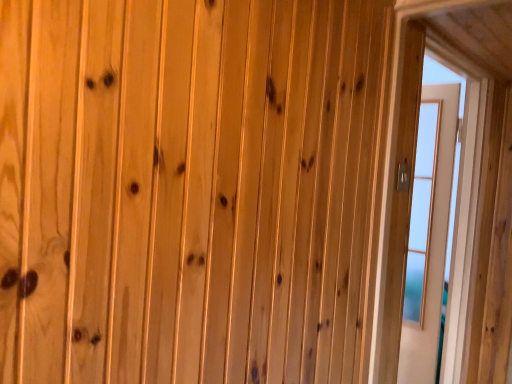
The image size is (512, 384). Describe the element at coordinates (429, 235) in the screenshot. I see `light brown wood door at right` at that location.

What is the approximate height of light brown wood door at right?

light brown wood door at right is 1.65 meters tall.

What is the approximate width of light brown wood door at right?

light brown wood door at right is 2.75 inches wide.

Where is `light brown wood door at right`? light brown wood door at right is located at coordinates (429, 235).

Measure the distance between light brown wood door at right and camera.

light brown wood door at right is 2.12 meters from camera.

The width and height of the screenshot is (512, 384). I want to click on transparent glass door at right, so click(x=395, y=193).

The width and height of the screenshot is (512, 384). What do you see at coordinates (395, 193) in the screenshot? I see `transparent glass door at right` at bounding box center [395, 193].

Find the location of a particular element. The height and width of the screenshot is (384, 512). light brown wood door at right is located at coordinates (429, 235).

Considering the relative positions of transparent glass door at right and light brown wood door at right in the image provided, is transparent glass door at right to the left or to the right of light brown wood door at right?

From the image, it's evident that transparent glass door at right is to the left of light brown wood door at right.

In the image, is transparent glass door at right positioned in front of or behind light brown wood door at right?

transparent glass door at right is in front of light brown wood door at right.

Does point (389, 288) come farther from viewer compared to point (439, 151)?

No, (389, 288) is closer to viewer.

From the picture: From the image's perspective, is transparent glass door at right over light brown wood door at right?

Yes, from the image's perspective, transparent glass door at right is above light brown wood door at right.

From a real-world perspective, between transparent glass door at right and light brown wood door at right, who is vertically lower?

light brown wood door at right.

Between transparent glass door at right and light brown wood door at right, which one has larger width?

With larger width is transparent glass door at right.

From the picture: Who is taller, transparent glass door at right or light brown wood door at right?

Standing taller between the two is light brown wood door at right.

Looking at this image, is transparent glass door at right bigger or smaller than light brown wood door at right?

Considering their sizes, transparent glass door at right takes up more space than light brown wood door at right.

Is transparent glass door at right not within light brown wood door at right?

Absolutely, transparent glass door at right is external to light brown wood door at right.

In the scene shown: Is transparent glass door at right directly adjacent to light brown wood door at right?

No, transparent glass door at right is not with light brown wood door at right.

Is transparent glass door at right looking in the opposite direction of light brown wood door at right?

Yes, transparent glass door at right is positioned with its back facing light brown wood door at right.

Identify the location of window to the left of light brown wood door at right. (395, 193).

Which is more to the right, light brown wood door at right or transparent glass door at right?

From the viewer's perspective, light brown wood door at right appears more on the right side.

Relative to transparent glass door at right, is light brown wood door at right in front or behind?

In the image, light brown wood door at right appears behind transparent glass door at right.

Which is behind, point (441, 250) or point (377, 313)?

Point (441, 250)

Consider the image. From the image's perspective, is light brown wood door at right located above or below transparent glass door at right?

From the image's perspective, light brown wood door at right appears below transparent glass door at right.

From a real-world perspective, is light brown wood door at right located beneath transparent glass door at right?

Indeed, from a real-world perspective, light brown wood door at right is positioned beneath transparent glass door at right.

Is light brown wood door at right wider or thinner than transparent glass door at right?

In the image, light brown wood door at right appears to be more narrow than transparent glass door at right.

Who is shorter, light brown wood door at right or transparent glass door at right?

With less height is transparent glass door at right.

Considering the relative sizes of light brown wood door at right and transparent glass door at right in the image provided, is light brown wood door at right smaller than transparent glass door at right?

Yes.

Is light brown wood door at right spatially inside transparent glass door at right, or outside of it?

light brown wood door at right is located beyond the bounds of transparent glass door at right.

Is light brown wood door at right far from transparent glass door at right?

No.

Could you tell me if light brown wood door at right is turned towards transparent glass door at right?

Yes.

You are a GUI agent. You are given a task and a screenshot of the screen. Output one action in this format:
    pyautogui.click(x=<x>, y=<y>)
    Task: Click on the window above the light brown wood door at right (from a real-world perspective)
    The image size is (512, 384).
    Given the screenshot: What is the action you would take?
    pyautogui.click(x=395, y=193)

I want to click on door below the transparent glass door at right (from the image's perspective), so click(429, 235).

Find the location of a particular element. This screenshot has height=384, width=512. window that is above the light brown wood door at right (from the image's perspective) is located at coordinates (395, 193).